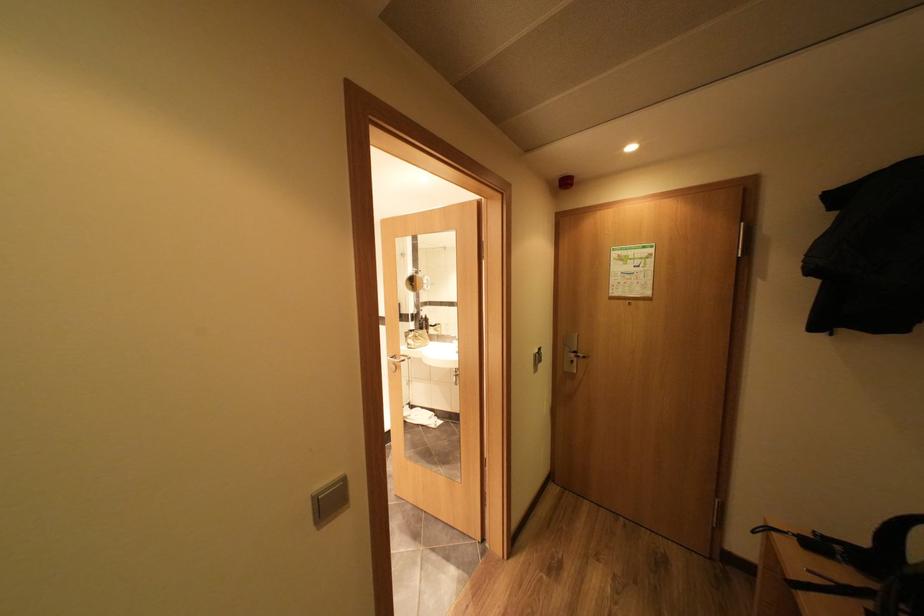
Where is `wall-mounted card slot`? The image size is (924, 616). wall-mounted card slot is located at coordinates (537, 359).